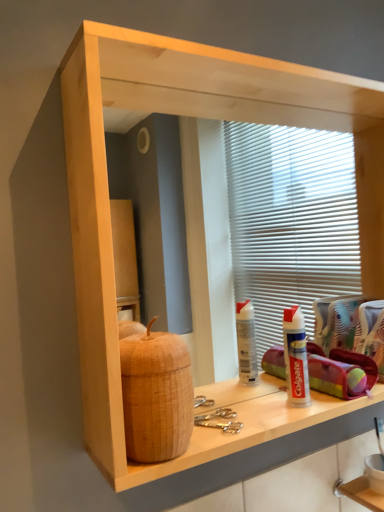
Question: From the image's perspective, is white wood shelf at lower right beneath white plastic toothpaste tube at lower right?

Choices:
 (A) no
 (B) yes

Answer: (B)

Question: Is white wood shelf at lower right positioned with its back to white plastic toothpaste tube at lower right?

Choices:
 (A) yes
 (B) no

Answer: (B)

Question: Is white wood shelf at lower right shorter than white plastic toothpaste tube at lower right?

Choices:
 (A) yes
 (B) no

Answer: (A)

Question: Are white wood shelf at lower right and white plastic toothpaste tube at lower right beside each other?

Choices:
 (A) no
 (B) yes

Answer: (A)

Question: Considering the relative positions of white wood shelf at lower right and white plastic toothpaste tube at lower right in the image provided, is white wood shelf at lower right in front of white plastic toothpaste tube at lower right?

Choices:
 (A) no
 (B) yes

Answer: (A)

Question: Looking at their shapes, would you say white wood shelf at lower right is wider or thinner than brown woven basket at left?

Choices:
 (A) wide
 (B) thin

Answer: (A)

Question: Is point (360, 482) positioned closer to the camera than point (125, 353)?

Choices:
 (A) farther
 (B) closer

Answer: (A)

Question: From a real-world perspective, is white wood shelf at lower right above or below brown woven basket at left?

Choices:
 (A) above
 (B) below

Answer: (B)

Question: From the image's perspective, is white wood shelf at lower right located above or below brown woven basket at left?

Choices:
 (A) above
 (B) below

Answer: (B)

Question: From their relative heights in the image, would you say white plastic toothpaste tube at lower right is taller or shorter than white wood shelf at lower right?

Choices:
 (A) short
 (B) tall

Answer: (B)

Question: Considering the positions of white plastic toothpaste tube at lower right and white wood shelf at lower right in the image, is white plastic toothpaste tube at lower right bigger or smaller than white wood shelf at lower right?

Choices:
 (A) small
 (B) big

Answer: (B)

Question: From a real-world perspective, is white plastic toothpaste tube at lower right above or below white wood shelf at lower right?

Choices:
 (A) below
 (B) above

Answer: (B)

Question: Would you say white plastic toothpaste tube at lower right is inside or outside white wood shelf at lower right?

Choices:
 (A) outside
 (B) inside

Answer: (A)

Question: Looking at the image, does white plastic toothpaste tube at lower right seem bigger or smaller compared to brown woven basket at left?

Choices:
 (A) small
 (B) big

Answer: (B)

Question: Is white plastic toothpaste tube at lower right inside the boundaries of brown woven basket at left, or outside?

Choices:
 (A) inside
 (B) outside

Answer: (B)